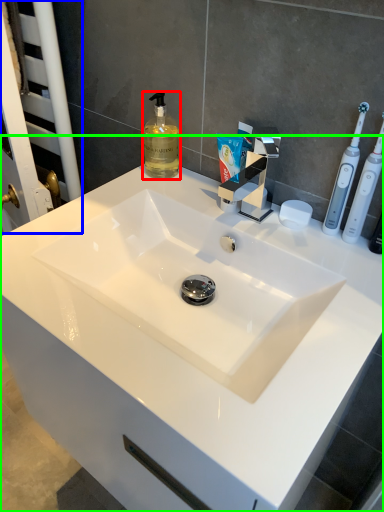
Question: Which object is positioned closest to soap dispenser (highlighted by a red box)? Select from screen door (highlighted by a blue box) and sink (highlighted by a green box).

Choices:
 (A) screen door
 (B) sink

Answer: (A)